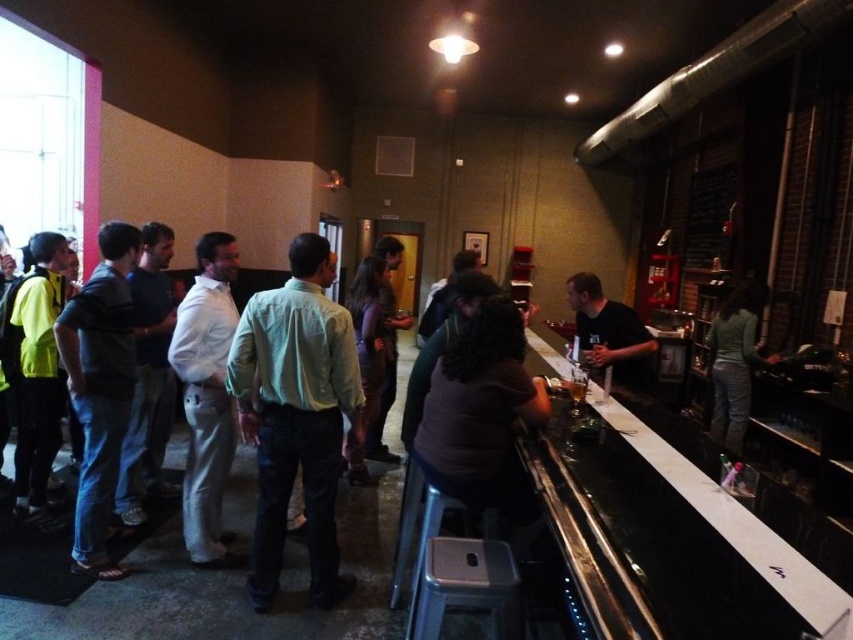
Question: Which of the following is the closest to the observer?

Choices:
 (A) (500, 499)
 (B) (712, 336)
 (C) (641, 337)
 (D) (184, 481)

Answer: (A)

Question: Which object appears closest to the camera in this image?

Choices:
 (A) dark brown leather jacket at bar
 (B) translucent glass beer at bar counter
 (C) translucent glass at bar counter
 (D) black matte shirt at bar

Answer: (A)

Question: Does white cotton shirt at center have a lesser width compared to metallic silver stool at lower center?

Choices:
 (A) no
 (B) yes

Answer: (A)

Question: Does metallic silver stool at lower center have a larger size compared to translucent glass at bar counter?

Choices:
 (A) no
 (B) yes

Answer: (B)

Question: Is white cotton shirt at center closer to the viewer compared to light green sweater at bar?

Choices:
 (A) no
 (B) yes

Answer: (B)

Question: Among these objects, which one is farthest from the camera?

Choices:
 (A) light green sweater at bar
 (B) light green shirt at center

Answer: (A)